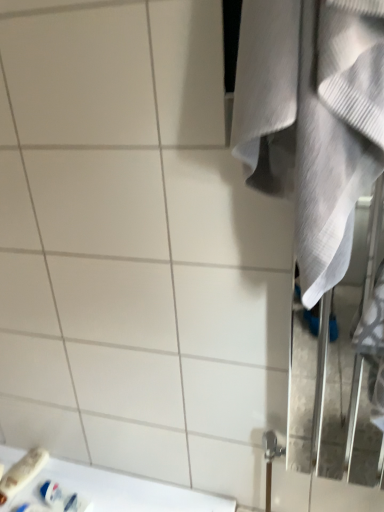
Question: Can you confirm if white plastic toothbrush at lower left, the second toiletry positioned from the right, is taller than white textured towel at right?

Choices:
 (A) yes
 (B) no

Answer: (B)

Question: Does white plastic toothbrush at lower left, the second toiletry positioned from the right, lie in front of white textured towel at right?

Choices:
 (A) no
 (B) yes

Answer: (A)

Question: Considering the relative positions of white plastic toothbrush at lower left, which ranks as the first toiletry in left-to-right order, and white textured towel at right in the image provided, is white plastic toothbrush at lower left, which ranks as the first toiletry in left-to-right order, behind white textured towel at right?

Choices:
 (A) no
 (B) yes

Answer: (B)

Question: Could you tell me if white plastic toothbrush at lower left, which ranks as the first toiletry in left-to-right order, is turned towards white textured towel at right?

Choices:
 (A) yes
 (B) no

Answer: (B)

Question: Would you say white textured towel at right is part of white plastic toothbrush at lower left, the second toiletry positioned from the right,'s contents?

Choices:
 (A) yes
 (B) no

Answer: (B)

Question: Is white plastic toothbrush at lower left, the second toiletry positioned from the right, bigger or smaller than white glossy counter top at lower left?

Choices:
 (A) big
 (B) small

Answer: (B)

Question: Is white plastic toothbrush at lower left, which ranks as the first toiletry in left-to-right order, in front of or behind white glossy counter top at lower left in the image?

Choices:
 (A) behind
 (B) front

Answer: (A)

Question: From a real-world perspective, is white plastic toothbrush at lower left, which ranks as the first toiletry in left-to-right order, physically located above or below white glossy counter top at lower left?

Choices:
 (A) below
 (B) above

Answer: (B)

Question: Considering the positions of point (39, 466) and point (114, 506), is point (39, 466) closer or farther from the camera than point (114, 506)?

Choices:
 (A) closer
 (B) farther

Answer: (B)

Question: From a real-world perspective, is white textured towel at right physically located above or below white plastic toothbrush at lower left, the second toiletry positioned from the right?

Choices:
 (A) above
 (B) below

Answer: (A)

Question: In terms of width, does white textured towel at right look wider or thinner when compared to white plastic toothbrush at lower left, the second toiletry positioned from the right?

Choices:
 (A) thin
 (B) wide

Answer: (A)

Question: Does point (317, 74) appear closer or farther from the camera than point (31, 454)?

Choices:
 (A) closer
 (B) farther

Answer: (A)

Question: Is white textured towel at right situated inside white plastic toothbrush at lower left, the second toiletry positioned from the right, or outside?

Choices:
 (A) outside
 (B) inside

Answer: (A)

Question: From the image's perspective, relative to white plastic toothbrush at lower left, the second toiletry positioned from the right, is white plastic toothpaste tube at lower left, which is the 2th toiletry in left-to-right order, above or below?

Choices:
 (A) above
 (B) below

Answer: (B)

Question: Is white plastic toothpaste tube at lower left, which is the first toiletry in right-to-left order, taller or shorter than white plastic toothbrush at lower left, which ranks as the first toiletry in left-to-right order?

Choices:
 (A) tall
 (B) short

Answer: (B)